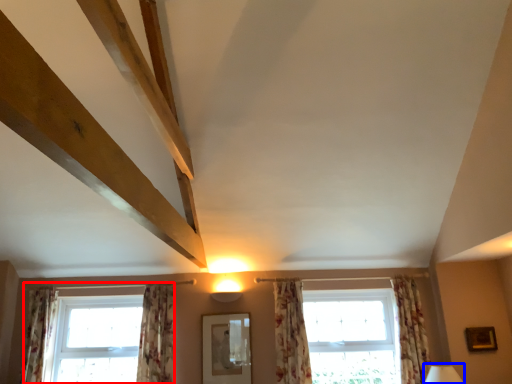
Question: Among these objects, which one is farthest to the camera, window (highlighted by a red box) or table lamp (highlighted by a blue box)?

Choices:
 (A) window
 (B) table lamp

Answer: (A)